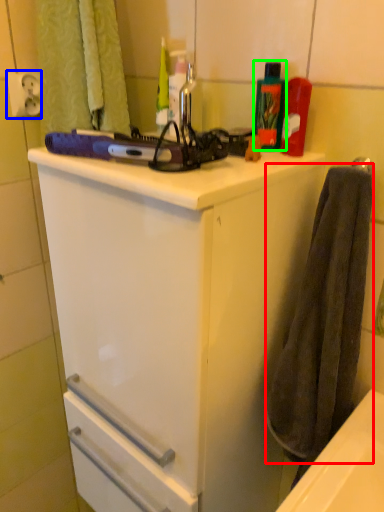
Question: Which object is positioned farthest from bath towel (highlighted by a red box)? Select from electric outlet (highlighted by a blue box) and cleaning product (highlighted by a green box).

Choices:
 (A) electric outlet
 (B) cleaning product

Answer: (A)